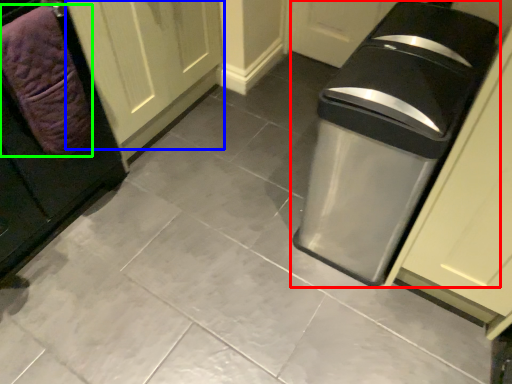
Question: Considering the real-world distances, which object is farthest from waste container (highlighted by a red box)? door (highlighted by a blue box) or blanket (highlighted by a green box)?

Choices:
 (A) door
 (B) blanket

Answer: (A)